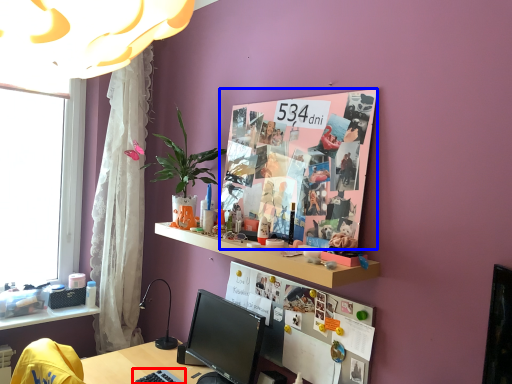
Question: Which object is closer to the camera taking this photo, keyboard (highlighted by a red box) or poster page (highlighted by a blue box)?

Choices:
 (A) keyboard
 (B) poster page

Answer: (B)